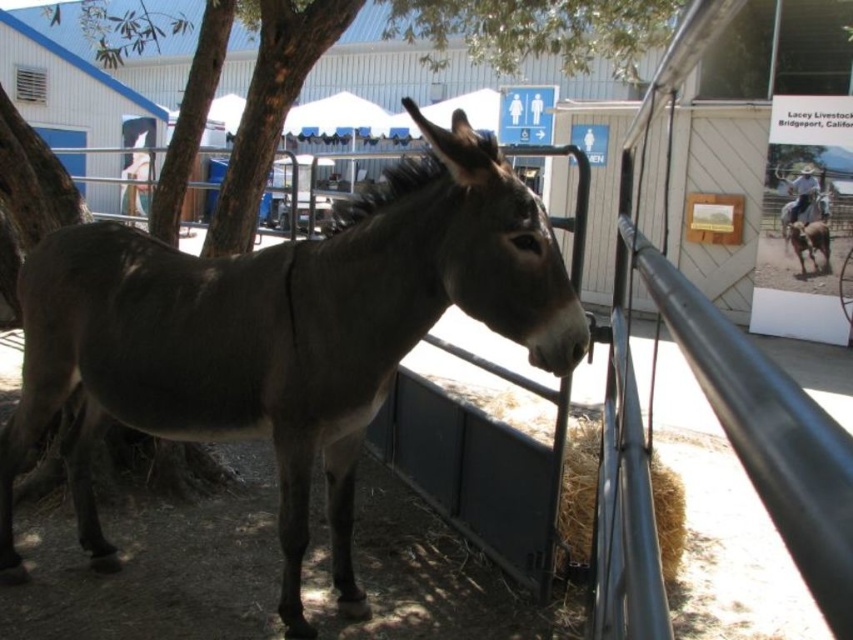
Which is behind, point (326, 474) or point (664, 515)?

The point (326, 474) is more distant.

In the scene shown: Is gray matte mule at center thinner than light brown straw at lower center?

No, gray matte mule at center is not thinner than light brown straw at lower center.

Where is `gray matte mule at center`? This screenshot has width=853, height=640. gray matte mule at center is located at coordinates (282, 333).

This screenshot has height=640, width=853. I want to click on gray matte mule at center, so click(282, 333).

In the scene shown: Is gray matte mule at center further to camera compared to green leafy tree at upper left?

That is False.

Who is lower down, gray matte mule at center or green leafy tree at upper left?

gray matte mule at center is lower down.

The width and height of the screenshot is (853, 640). Describe the element at coordinates (282, 333) in the screenshot. I see `gray matte mule at center` at that location.

Identify the location of gray matte mule at center. This screenshot has width=853, height=640. (282, 333).

Based on the photo, who is more forward, (285,115) or (579,480)?

Point (579,480) is in front.

Does green leafy tree at upper left come in front of light brown straw at lower center?

No, it is behind light brown straw at lower center.

Which is behind, point (434, 48) or point (589, 426)?

Positioned behind is point (434, 48).

You are a GUI agent. You are given a task and a screenshot of the screen. Output one action in this format:
    pyautogui.click(x=<x>, y=<y>)
    Task: Click on the green leafy tree at upper left
    This screenshot has width=853, height=640.
    Given the screenshot: What is the action you would take?
    pyautogui.click(x=535, y=29)